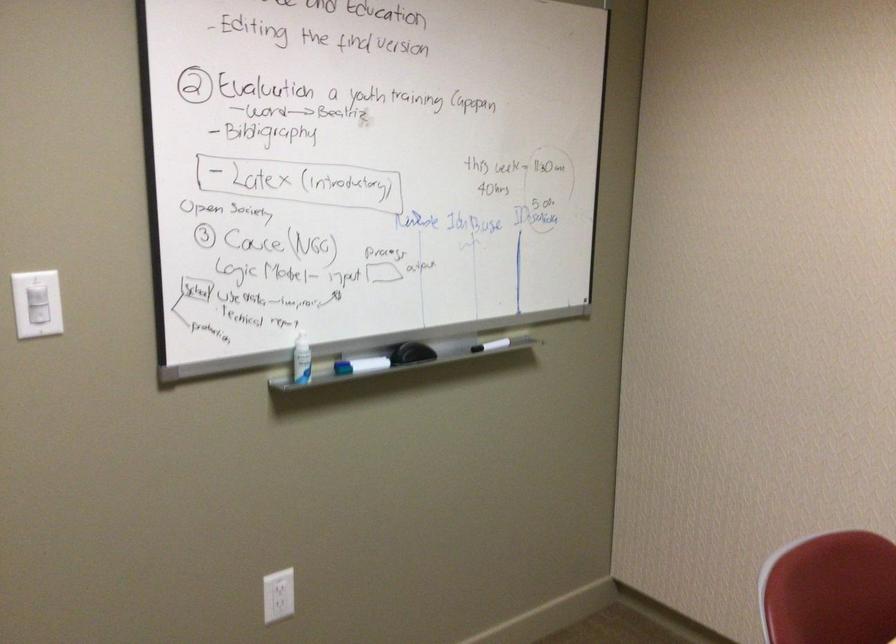
Describe the element at coordinates (38, 304) in the screenshot. The width and height of the screenshot is (896, 644). I see `the white light switch` at that location.